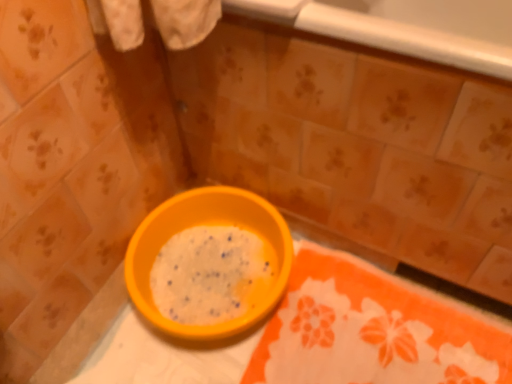
Question: From a real-world perspective, is orange fabric tablecloth at lower right below orange plastic bowl at center?

Choices:
 (A) yes
 (B) no

Answer: (A)

Question: Can you confirm if orange fabric tablecloth at lower right is wider than orange plastic bowl at center?

Choices:
 (A) yes
 (B) no

Answer: (A)

Question: Is orange fabric tablecloth at lower right far from orange plastic bowl at center?

Choices:
 (A) no
 (B) yes

Answer: (A)

Question: Does orange fabric tablecloth at lower right have a lesser height compared to orange plastic bowl at center?

Choices:
 (A) yes
 (B) no

Answer: (A)

Question: Is orange fabric tablecloth at lower right at the left side of orange plastic bowl at center?

Choices:
 (A) yes
 (B) no

Answer: (B)

Question: Is orange fabric tablecloth at lower right to the right of orange plastic bowl at center from the viewer's perspective?

Choices:
 (A) no
 (B) yes

Answer: (B)

Question: Considering the relative positions of orange plastic bowl at center and orange fabric tablecloth at lower right in the image provided, is orange plastic bowl at center to the left of orange fabric tablecloth at lower right from the viewer's perspective?

Choices:
 (A) yes
 (B) no

Answer: (A)

Question: Can you confirm if orange plastic bowl at center is wider than orange fabric tablecloth at lower right?

Choices:
 (A) no
 (B) yes

Answer: (A)

Question: Is orange plastic bowl at center positioned with its back to orange fabric tablecloth at lower right?

Choices:
 (A) yes
 (B) no

Answer: (B)

Question: Is orange plastic bowl at center not near orange fabric tablecloth at lower right?

Choices:
 (A) yes
 (B) no

Answer: (B)

Question: From a real-world perspective, is orange plastic bowl at center on orange fabric tablecloth at lower right?

Choices:
 (A) no
 (B) yes

Answer: (B)

Question: From a real-world perspective, is orange plastic bowl at center below orange fabric tablecloth at lower right?

Choices:
 (A) no
 (B) yes

Answer: (A)

Question: Is orange fabric tablecloth at lower right inside the boundaries of orange plastic bowl at center, or outside?

Choices:
 (A) inside
 (B) outside

Answer: (B)